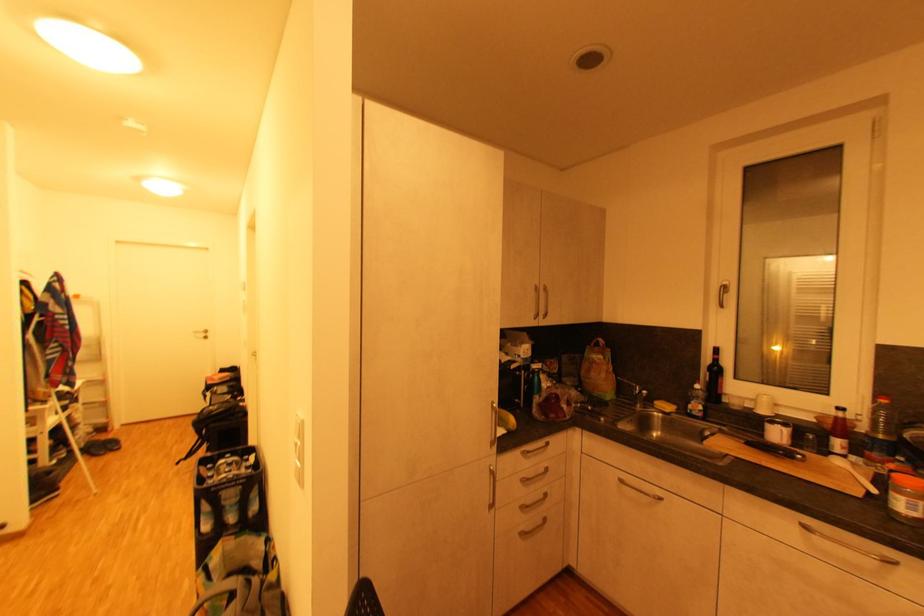
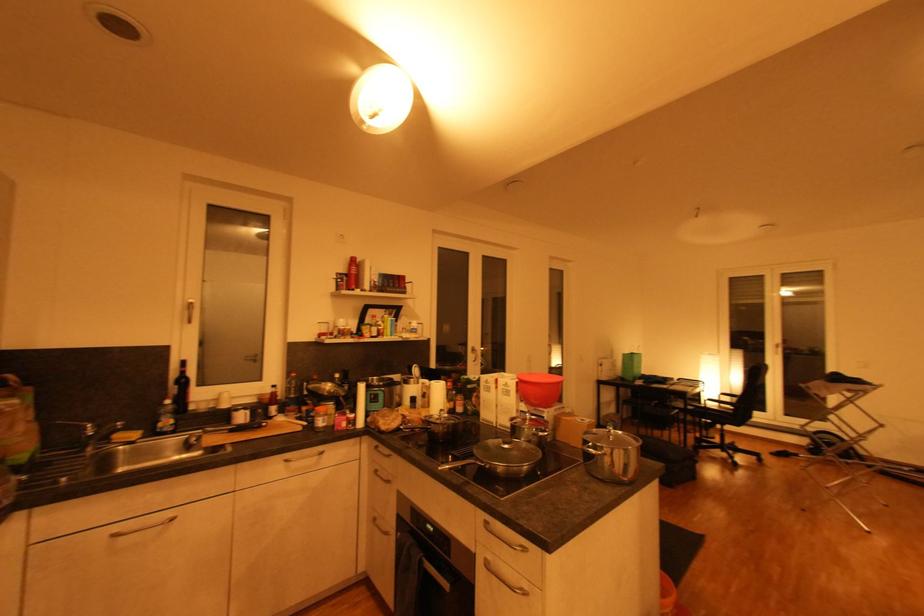
Question: Based on the continuous images, in which direction is the camera rotating? Reply with the corresponding letter.

Choices:
 (A) Left
 (B) Right
 (C) Up
 (D) Down

Answer: (B)